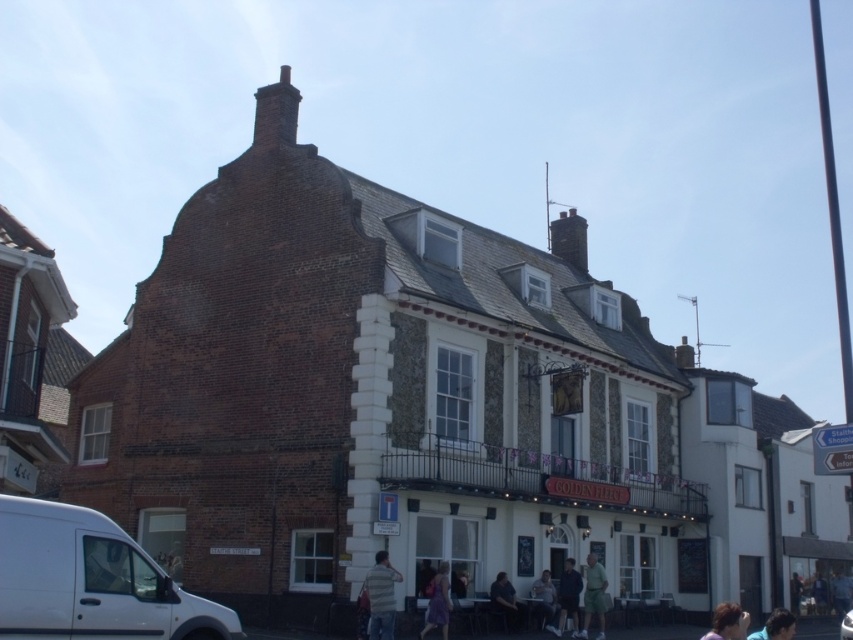
Question: Can you confirm if blonde hair at lower right is smaller than light brown leather jacket at lower right?

Choices:
 (A) no
 (B) yes

Answer: (A)

Question: Which of the following is the farthest from the observer?

Choices:
 (A) (508, 596)
 (B) (537, 612)

Answer: (B)

Question: Can you confirm if white matte van at lower left is bigger than dark blue shirt at lower center?

Choices:
 (A) no
 (B) yes

Answer: (B)

Question: Among these objects, which one is farthest from the camera?

Choices:
 (A) blue fabric headscarf at lower right
 (B) dark brown brick chimney at upper center
 (C) white matte van at lower left

Answer: (B)

Question: Is striped shirt at lower center below blue fabric headscarf at lower right?

Choices:
 (A) yes
 (B) no

Answer: (B)

Question: Which point is closer to the camera?

Choices:
 (A) dark brown brick chimney at upper center
 (B) blue fabric headscarf at lower right
 (C) white matte van at lower left
 (D) light brown leather jacket at lower right

Answer: (C)